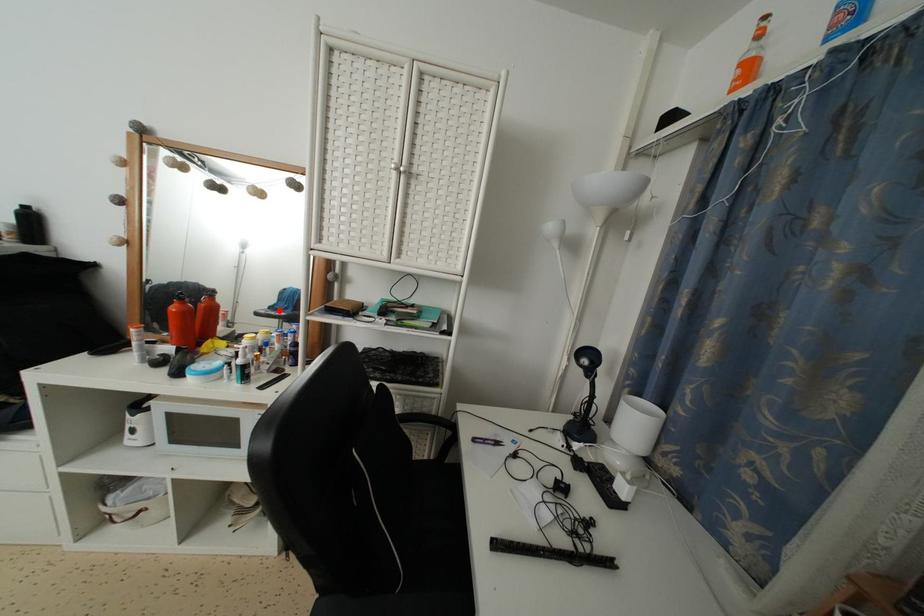
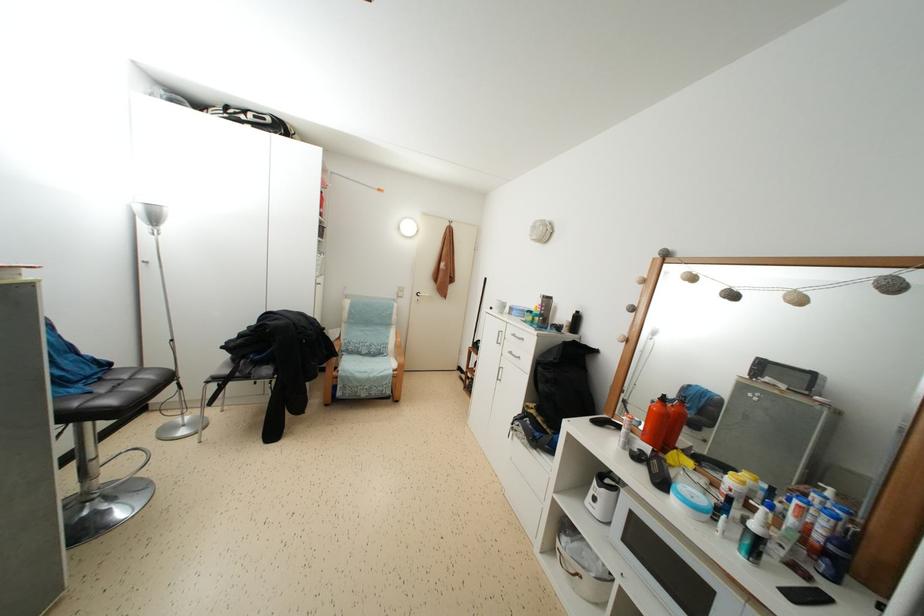
Find the pixel in the second image that matches the highlighted location in the first image.

(677, 406)